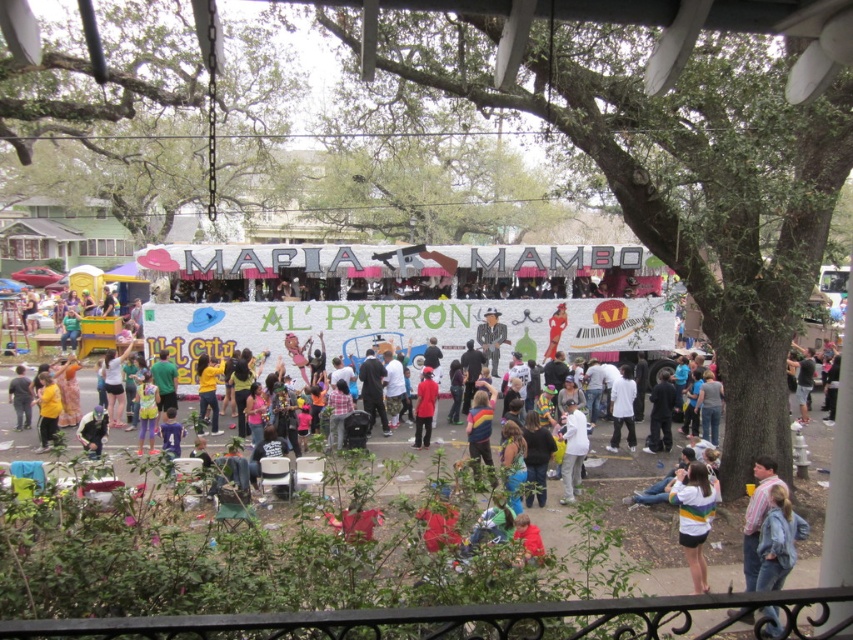
You are a photographer at the event and want to capture a photo of the matte red coat at center without the white cardboard signboard at center blocking it. How should you adjust your position?

Move your position so that the matte red coat at center is no longer under the white cardboard signboard at center. Since the white cardboard signboard at center is above the matte red coat at center, moving to the side or adjusting the angle could allow you to frame the coat without the signboard blocking it.

You are a photographer at the event and want to capture both the white cotton shirt at center and the matte red coat at center in a single frame. Which clothing item will appear taller in the photo?

The matte red coat at center will appear taller in the photo because it is taller than the white cotton shirt at center.